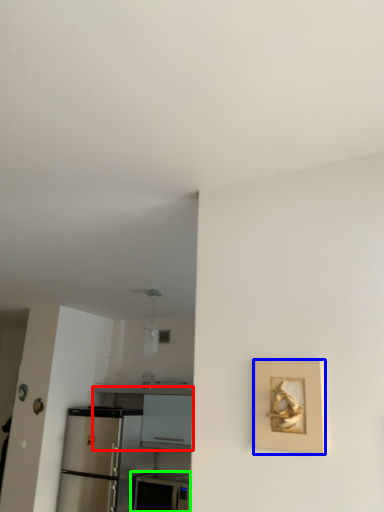
Question: Which is farther away from counter (highlighted by a red box)? picture frame (highlighted by a blue box) or appliance (highlighted by a green box)?

Choices:
 (A) picture frame
 (B) appliance

Answer: (A)